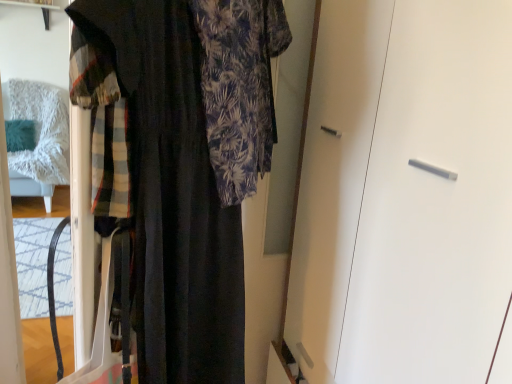
What do you see at coordinates (184, 163) in the screenshot? I see `dark blue textured dress at left` at bounding box center [184, 163].

Locate an element on the screen. This screenshot has height=384, width=512. dark blue textured dress at left is located at coordinates (184, 163).

What do you see at coordinates (435, 201) in the screenshot? I see `white matte cabinet at center` at bounding box center [435, 201].

Locate an element on the screen. The image size is (512, 384). white matte cabinet at center is located at coordinates (435, 201).

Find the location of a particular element. dark blue textured dress at left is located at coordinates (184, 163).

Between dark blue textured dress at left and white matte cabinet at center, which one appears on the left side from the viewer's perspective?

dark blue textured dress at left is more to the left.

Which object is more forward, dark blue textured dress at left or white matte cabinet at center?

dark blue textured dress at left is in front.

Between point (199, 121) and point (385, 106), which one is positioned in front?

The point (385, 106) is in front.

Based on the photo, from the image's perspective, between dark blue textured dress at left and white matte cabinet at center, which one is located above?

From the image's view, dark blue textured dress at left is above.

From a real-world perspective, which is physically above, dark blue textured dress at left or white matte cabinet at center?

dark blue textured dress at left.

Between dark blue textured dress at left and white matte cabinet at center, which one has larger width?

Wider between the two is white matte cabinet at center.

Does dark blue textured dress at left have a lesser height compared to white matte cabinet at center?

Correct, dark blue textured dress at left is not as tall as white matte cabinet at center.

Does dark blue textured dress at left have a larger size compared to white matte cabinet at center?

No.

Is dark blue textured dress at left spatially inside white matte cabinet at center, or outside of it?

dark blue textured dress at left is located beyond the bounds of white matte cabinet at center.

Is dark blue textured dress at left far from white matte cabinet at center?

No, there isn't a large distance between dark blue textured dress at left and white matte cabinet at center.

Is dark blue textured dress at left oriented towards white matte cabinet at center?

Yes, dark blue textured dress at left is turned towards white matte cabinet at center.

What's the angular difference between dark blue textured dress at left and white matte cabinet at center's facing directions?

dark blue textured dress at left and white matte cabinet at center are facing 142 degrees away from each other.

How distant is dark blue textured dress at left from white matte cabinet at center?

dark blue textured dress at left and white matte cabinet at center are 17.93 inches apart from each other.

At what (x,y) coordinates should I click in order to perform the action: click on fancy dress lying on the left of white matte cabinet at center. Please return your answer as a coordinate pair (x, y). Image resolution: width=512 pixels, height=384 pixels. Looking at the image, I should click on (184, 163).

Is white matte cabinet at center to the left or to the right of dark blue textured dress at left in the image?

From the image, it's evident that white matte cabinet at center is to the right of dark blue textured dress at left.

Which object is closer to the camera, white matte cabinet at center or dark blue textured dress at left?

dark blue textured dress at left is in front.

Is point (447, 231) positioned behind point (131, 208)?

No, it is in front of (131, 208).

From the image's perspective, is white matte cabinet at center beneath dark blue textured dress at left?

Yes.

From a real-world perspective, which is physically above, white matte cabinet at center or dark blue textured dress at left?

In real-world perspective, dark blue textured dress at left is above.

Which of these two, white matte cabinet at center or dark blue textured dress at left, is wider?

Wider between the two is white matte cabinet at center.

Between white matte cabinet at center and dark blue textured dress at left, which one has more height?

With more height is white matte cabinet at center.

Is white matte cabinet at center smaller than dark blue textured dress at left?

Actually, white matte cabinet at center might be larger than dark blue textured dress at left.

Is white matte cabinet at center located outside dark blue textured dress at left?

Indeed, white matte cabinet at center is completely outside dark blue textured dress at left.

Is white matte cabinet at center far away from dark blue textured dress at left?

Actually, white matte cabinet at center and dark blue textured dress at left are a little close together.

Is white matte cabinet at center facing away from dark blue textured dress at left?

Yes, white matte cabinet at center is positioned with its back facing dark blue textured dress at left.

How many degrees apart are the facing directions of white matte cabinet at center and dark blue textured dress at left?

The facing directions of white matte cabinet at center and dark blue textured dress at left are 142 degrees apart.

The image size is (512, 384). Find the location of `screen door that appears on the right of dark blue textured dress at left`. screen door that appears on the right of dark blue textured dress at left is located at coordinates pyautogui.click(x=435, y=201).

This screenshot has width=512, height=384. What are the coordinates of `fancy dress on the left of white matte cabinet at center` in the screenshot? It's located at (184, 163).

This screenshot has height=384, width=512. I want to click on screen door on the right side of dark blue textured dress at left, so click(435, 201).